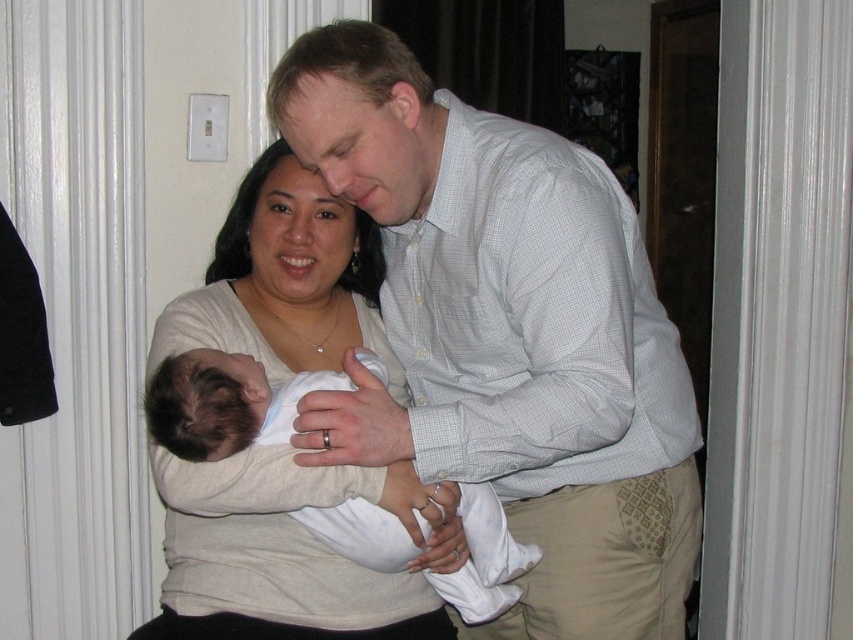
Consider the image. Can you confirm if light blue checkered shirt at center is positioned to the right of light beige sweater at center?

Indeed, light blue checkered shirt at center is positioned on the right side of light beige sweater at center.

Between light blue checkered shirt at center and light beige sweater at center, which one has less height?

Standing shorter between the two is light beige sweater at center.

Between point (351, 29) and point (187, 506), which one is positioned behind?

The point (351, 29) is more distant.

This screenshot has height=640, width=853. I want to click on light blue checkered shirt at center, so click(x=506, y=336).

Which is more to the left, light blue checkered shirt at center or white soft fabric newborn at center?

Positioned to the left is white soft fabric newborn at center.

From the picture: Which is more to the right, light blue checkered shirt at center or white soft fabric newborn at center?

Positioned to the right is light blue checkered shirt at center.

Does point (337, 419) come closer to viewer compared to point (241, 404)?

No.

Image resolution: width=853 pixels, height=640 pixels. Find the location of `light blue checkered shirt at center`. light blue checkered shirt at center is located at coordinates (506, 336).

This screenshot has height=640, width=853. Identify the location of light beige sweater at center. (289, 552).

What do you see at coordinates (289, 552) in the screenshot? The width and height of the screenshot is (853, 640). I see `light beige sweater at center` at bounding box center [289, 552].

Identify the location of light beige sweater at center. (289, 552).